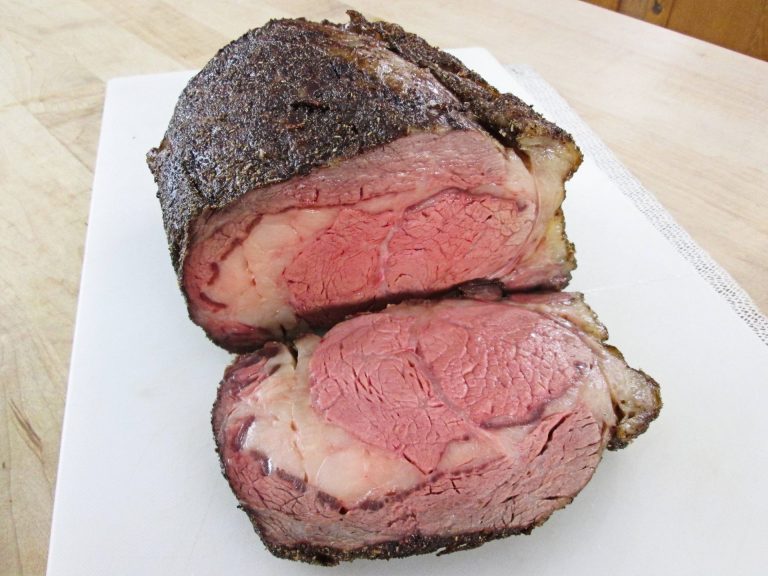
Find the location of a particular element. The width and height of the screenshot is (768, 576). brown table is located at coordinates (25, 210).